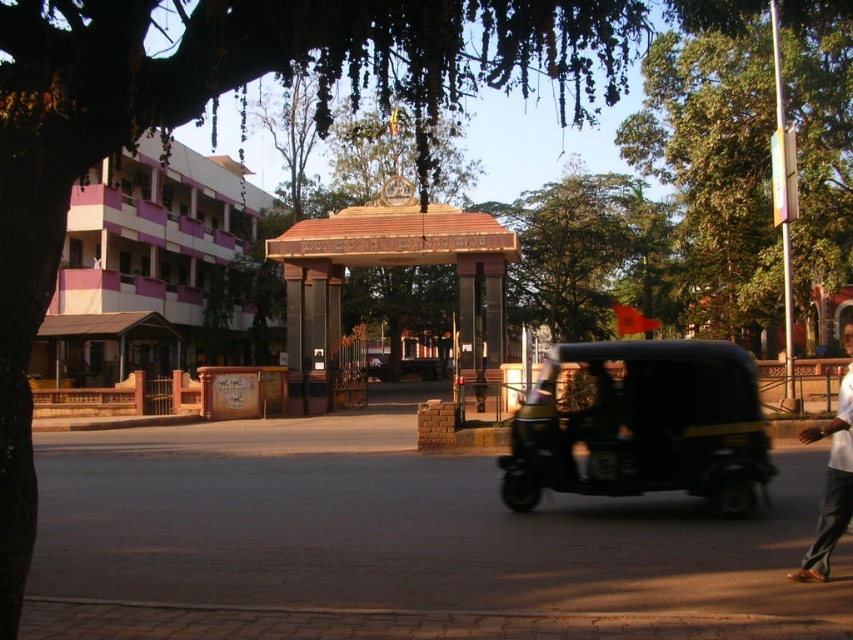
From the picture: You are a pedestrian standing at the entrance of the gateway. You see a green leafy tree at upper right and a white cotton shirt at lower right. Which object is positioned to the right of the other?

The green leafy tree at upper right is to the right of the white cotton shirt at lower right according to the description.

You are standing at the point with coordinates (714, 156) in the image. What object is located at that point?

The green leafy tree at upper right is located at point (714, 156).